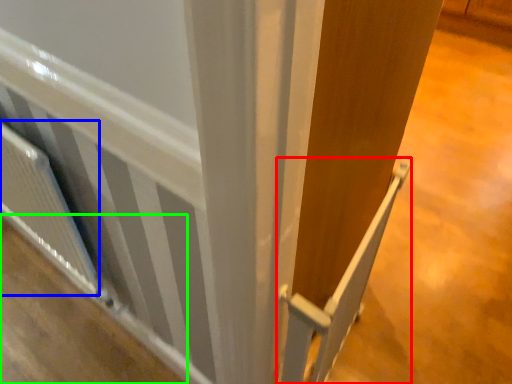
Question: Which object is the farthest from rail (highlighted by a red box)? Choose among these: radiator (highlighted by a blue box) or plywood (highlighted by a green box).

Choices:
 (A) radiator
 (B) plywood

Answer: (B)